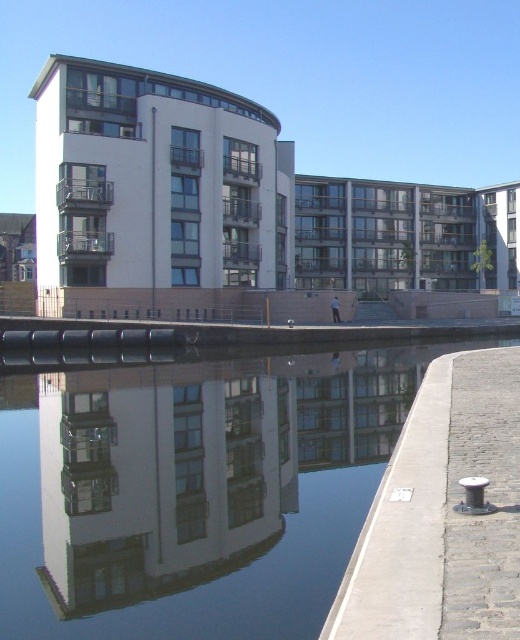
Question: Where is concrete at lower right located in relation to gray cobblestone pavement at lower right in the image?

Choices:
 (A) below
 (B) above

Answer: (A)

Question: Which of the following is the farthest from the observer?

Choices:
 (A) (514, 492)
 (B) (238, 420)
 (C) (468, 477)

Answer: (B)

Question: Does concrete at lower right have a smaller size compared to gray cobblestone pavement at lower right?

Choices:
 (A) yes
 (B) no

Answer: (B)

Question: Which object appears farthest from the camera in this image?

Choices:
 (A) gray cobblestone pavement at lower right
 (B) transparent glass canal at lower left
 (C) concrete at lower right

Answer: (B)

Question: Is transparent glass canal at lower left positioned behind concrete at lower right?

Choices:
 (A) yes
 (B) no

Answer: (A)

Question: Which point is farther to the camera?

Choices:
 (A) (213, 522)
 (B) (458, 413)
 (C) (477, 552)

Answer: (B)